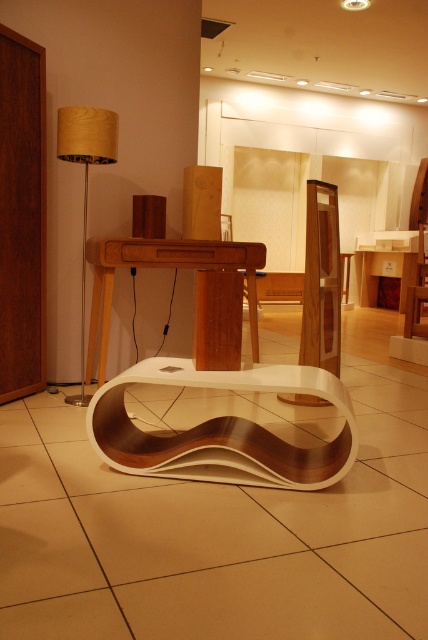
You are standing in the showroom and want to move from the point at coordinates (103,138) to the point at coordinates (380,253). Which direction should you move in?

You should move backward to reach the point at coordinates (380,253) because point (103,138) is in front of it.

You are standing in the showroom and want to take a photo of the two points mentioned. Which point, point (190, 442) or point (413, 278), will appear larger in your camera view?

Point (190, 442) is closer to the camera than point (413, 278), so it will appear larger in the camera view.